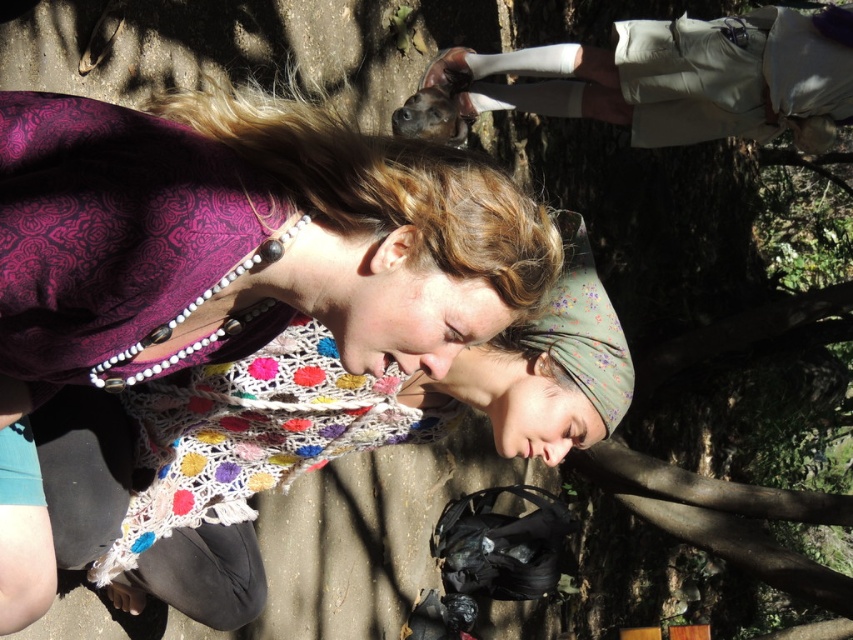
You are navigating through a forest and see two points marked on your map. The first point is at coordinates point (244, 401) and the second is at point (584, 72). If you are facing north, which point is closer to your current position?

The point at coordinates point (244, 401) is in front of point (584, 72), so if you are facing north, the point at point (244, 401) is closer to your current position.

Looking at this image, you are a photographer trying to capture a closeup of the light beige shorts at upper right. To do so, you need to position yourself so that the multicolored crochet scarf at center is not blocking your view. Which direction should you move relative to the scarf?

Move to the right of the multicolored crochet scarf at center so that the light beige shorts at upper right becomes visible without obstruction.

Based on the photo, you are a photographer trying to capture a closeup of the multicolored crochet scarf at center and the light beige shorts at upper right in the same frame. Given that your camera has a maximum focus range of 2 meters, will you be able to include both objects in the shot?

The multicolored crochet scarf at center is 1.98 meters from the light beige shorts at upper right, which is within the camera maximum focus range of 2 meters. So yes, you can include both objects in the shot.